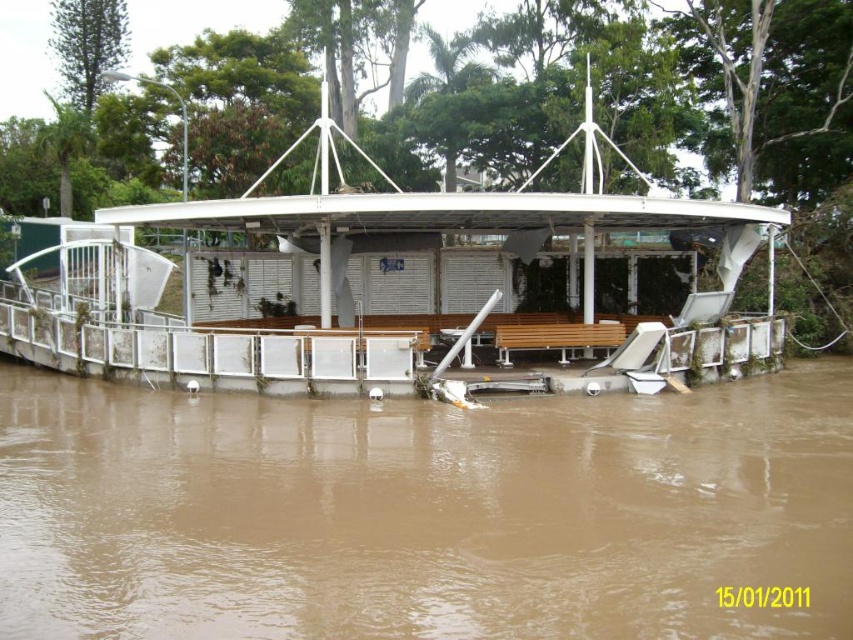
Between brown matte wood at center and wooden bench at center, which one has more height?

With more height is brown matte wood at center.

Which of these two, brown matte wood at center or wooden bench at center, stands shorter?

wooden bench at center

Does point (451, 496) come behind point (537, 332)?

No, it is not.

You are a GUI agent. You are given a task and a screenshot of the screen. Output one action in this format:
    pyautogui.click(x=<x>, y=<y>)
    Task: Click on the brown matte wood at center
    
    Given the screenshot: What is the action you would take?
    pyautogui.click(x=422, y=513)

Which of these two, brown matte wood at center or white matte boat at center, stands taller?

white matte boat at center is taller.

Which of these two, brown matte wood at center or white matte boat at center, stands shorter?

With less height is brown matte wood at center.

Is point (544, 620) closer to camera compared to point (546, 228)?

That is True.

Find the location of `brown matte wood at center`. brown matte wood at center is located at coordinates click(422, 513).

Is white matte boat at center positioned in front of wooden bench at center?

Yes, white matte boat at center is in front of wooden bench at center.

Is white matte boat at center taller than wooden bench at center?

Yes.

Between point (223, 342) and point (608, 323), which one is positioned in front?

Point (223, 342) is more forward.

Identify the location of white matte boat at center. This screenshot has height=640, width=853. (386, 285).